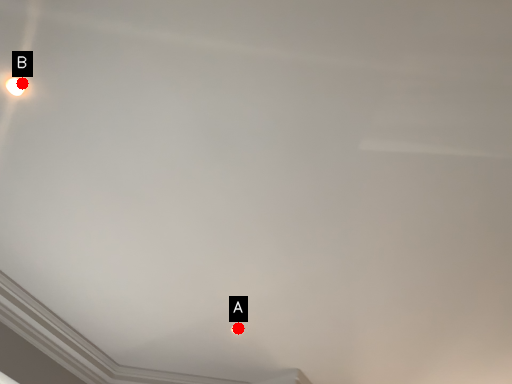
Question: Two points are circled on the image, labeled by A and B beside each circle. Which of the following is the farthest from the observer?

Choices:
 (A) A is further
 (B) B is further

Answer: (A)